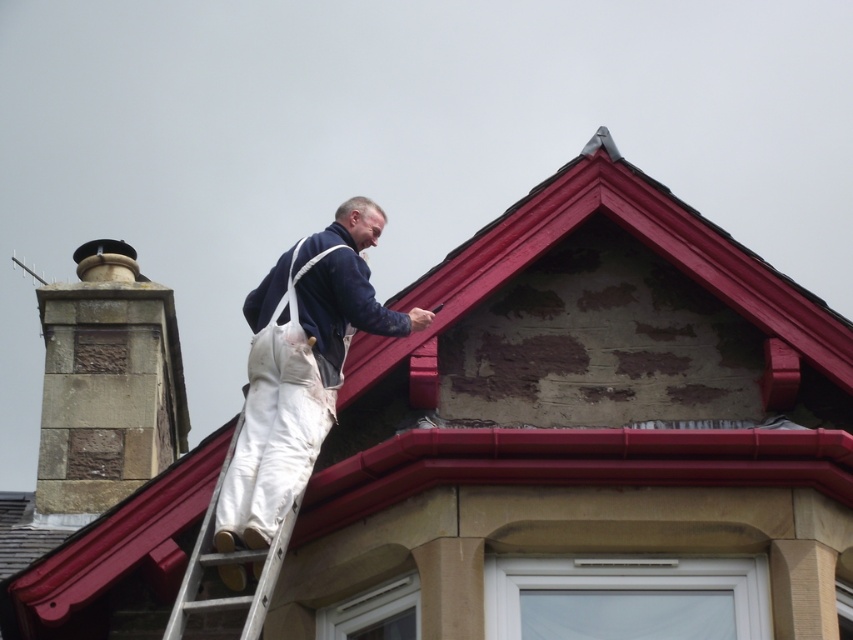
Question: Can you confirm if brown stone chimney at left is bigger than white canvas overalls at upper center?

Choices:
 (A) no
 (B) yes

Answer: (B)

Question: Which point is farther from the camera taking this photo?

Choices:
 (A) (323, 292)
 (B) (196, 563)
 (C) (181, 401)

Answer: (C)

Question: Is the position of brown stone chimney at left more distant than that of white canvas overalls at upper center?

Choices:
 (A) yes
 (B) no

Answer: (A)

Question: Can you confirm if brown stone chimney at left is bigger than white fabric ladder at center?

Choices:
 (A) yes
 (B) no

Answer: (A)

Question: Which point is closer to the camera?

Choices:
 (A) pos(138,392)
 (B) pos(403,324)
 (C) pos(229,589)

Answer: (C)

Question: Which point is closer to the camera?

Choices:
 (A) brown stone chimney at left
 (B) white canvas overalls at upper center
 (C) white fabric ladder at center

Answer: (B)